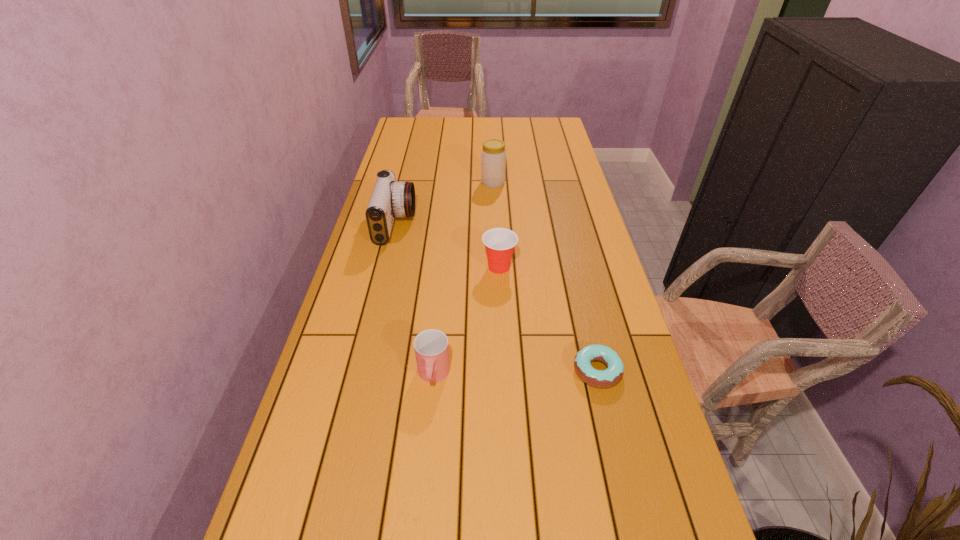
At what (x,y) coordinates should I click in order to perform the action: click on vacant space located on the surface of the leftmost object. Please return your answer as a coordinate pair (x, y). Image resolution: width=960 pixels, height=540 pixels. Looking at the image, I should click on (474, 225).

The height and width of the screenshot is (540, 960). I want to click on free space located 0.050m on the front of the farther cup, so click(x=500, y=291).

The height and width of the screenshot is (540, 960). In order to click on vacant space situated on the side of the left cup with the handle in this screenshot , I will do click(426, 450).

This screenshot has height=540, width=960. What are the coordinates of `free space located on the back of the doughnut` in the screenshot? It's located at (585, 316).

Find the location of a particular element. object that is at the left edge is located at coordinates (389, 199).

Where is `object that is positioned at the right edge`? The image size is (960, 540). object that is positioned at the right edge is located at coordinates (606, 378).

Where is `vacant region at the far edge of the desktop`? The width and height of the screenshot is (960, 540). vacant region at the far edge of the desktop is located at coordinates (519, 117).

Identify the location of vacant area at the left edge. (409, 159).

In the image, there is a desktop. Identify the location of vacant space at the right edge. (554, 171).

Identify the location of free region at the far left corner of the desktop. The width and height of the screenshot is (960, 540). (411, 118).